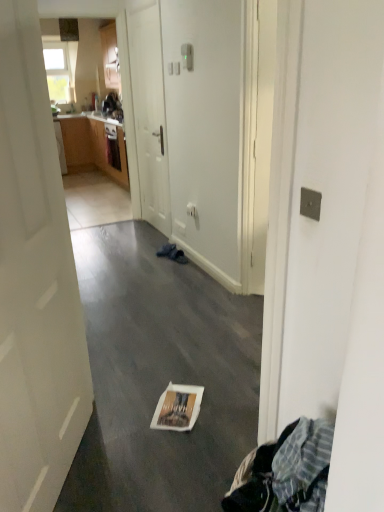
Question: From their relative heights in the image, would you say white matte door at center, the first door viewed from the back, is taller or shorter than white paper bag at center?

Choices:
 (A) short
 (B) tall

Answer: (B)

Question: Is white matte door at center, the first door viewed from the back, to the left or to the right of white paper bag at center in the image?

Choices:
 (A) right
 (B) left

Answer: (B)

Question: Considering the real-world distances, which object is farthest from the white paper bag at center?

Choices:
 (A) white glossy door at left, arranged as the 1th door when viewed from the front
 (B) white matte door at center, which is the second door from front to back
 (C) white glossy magazine at center

Answer: (B)

Question: Which object is the farthest from the white matte door at center, the first door viewed from the back?

Choices:
 (A) white glossy magazine at center
 (B) white paper bag at center
 (C) white glossy door at left, the 2th door viewed from the back

Answer: (A)